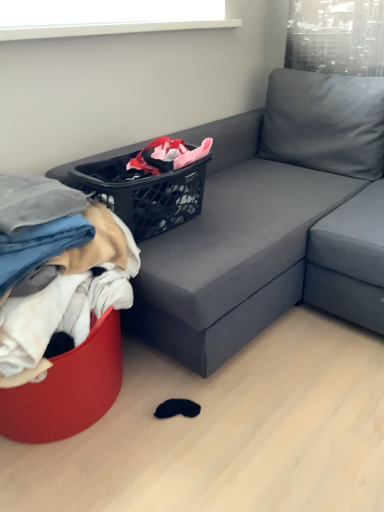
Question: Is black plastic basket at upper center aimed at soft cotton clothes at left, arranged as the second clothing when viewed from the top?

Choices:
 (A) yes
 (B) no

Answer: (B)

Question: Considering the relative sizes of black plastic basket at upper center and soft cotton clothes at left, marked as the 1th clothing in a bottom-to-top arrangement, in the image provided, is black plastic basket at upper center bigger than soft cotton clothes at left, marked as the 1th clothing in a bottom-to-top arrangement,?

Choices:
 (A) yes
 (B) no

Answer: (B)

Question: From a real-world perspective, is black plastic basket at upper center physically above soft cotton clothes at left, arranged as the second clothing when viewed from the top?

Choices:
 (A) no
 (B) yes

Answer: (B)

Question: Considering the relative positions of black plastic basket at upper center and soft cotton clothes at left, marked as the 1th clothing in a bottom-to-top arrangement, in the image provided, is black plastic basket at upper center to the left of soft cotton clothes at left, marked as the 1th clothing in a bottom-to-top arrangement, from the viewer's perspective?

Choices:
 (A) no
 (B) yes

Answer: (A)

Question: Is black plastic basket at upper center positioned behind soft cotton clothes at left, marked as the 1th clothing in a bottom-to-top arrangement?

Choices:
 (A) yes
 (B) no

Answer: (A)

Question: Is black plastic basket at upper center thinner than soft cotton clothes at left, arranged as the second clothing when viewed from the top?

Choices:
 (A) no
 (B) yes

Answer: (B)

Question: Is denim fabric pants at lower left, the 2th clothing when ordered from bottom to top, in contact with soft cotton clothes at left, marked as the 1th clothing in a bottom-to-top arrangement?

Choices:
 (A) yes
 (B) no

Answer: (B)

Question: From the image's perspective, is denim fabric pants at lower left, which appears as the first clothing when viewed from the top, above soft cotton clothes at left, arranged as the second clothing when viewed from the top?

Choices:
 (A) no
 (B) yes

Answer: (B)

Question: Is denim fabric pants at lower left, which appears as the first clothing when viewed from the top, shorter than soft cotton clothes at left, marked as the 1th clothing in a bottom-to-top arrangement?

Choices:
 (A) no
 (B) yes

Answer: (B)

Question: Is denim fabric pants at lower left, the 2th clothing when ordered from bottom to top, far away from soft cotton clothes at left, arranged as the second clothing when viewed from the top?

Choices:
 (A) yes
 (B) no

Answer: (B)

Question: From the image's perspective, does denim fabric pants at lower left, which appears as the first clothing when viewed from the top, appear lower than soft cotton clothes at left, marked as the 1th clothing in a bottom-to-top arrangement?

Choices:
 (A) yes
 (B) no

Answer: (B)

Question: Is denim fabric pants at lower left, the 2th clothing when ordered from bottom to top, positioned in front of soft cotton clothes at left, marked as the 1th clothing in a bottom-to-top arrangement?

Choices:
 (A) yes
 (B) no

Answer: (B)

Question: Is black plastic basket at upper center shorter than denim fabric pants at lower left, the 2th clothing when ordered from bottom to top?

Choices:
 (A) yes
 (B) no

Answer: (B)